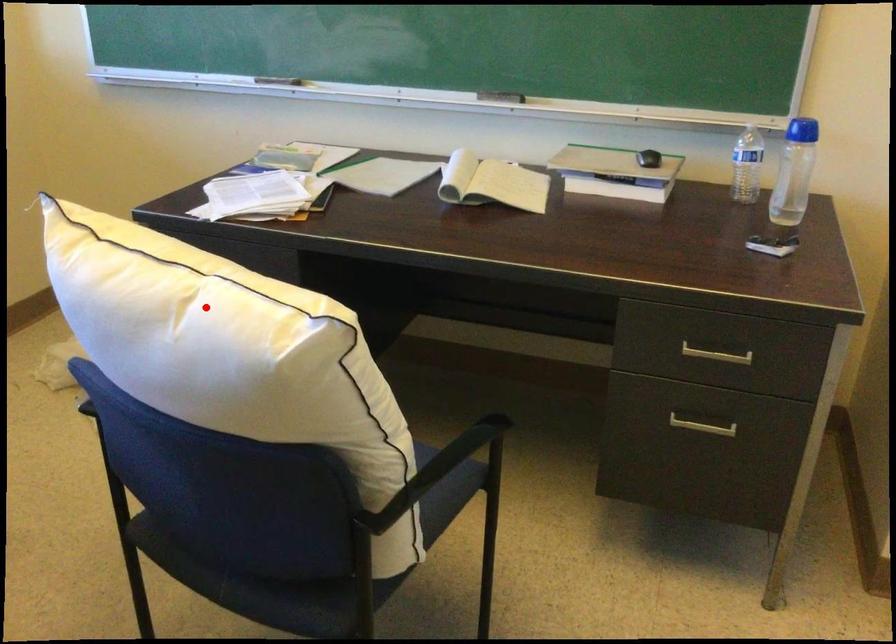
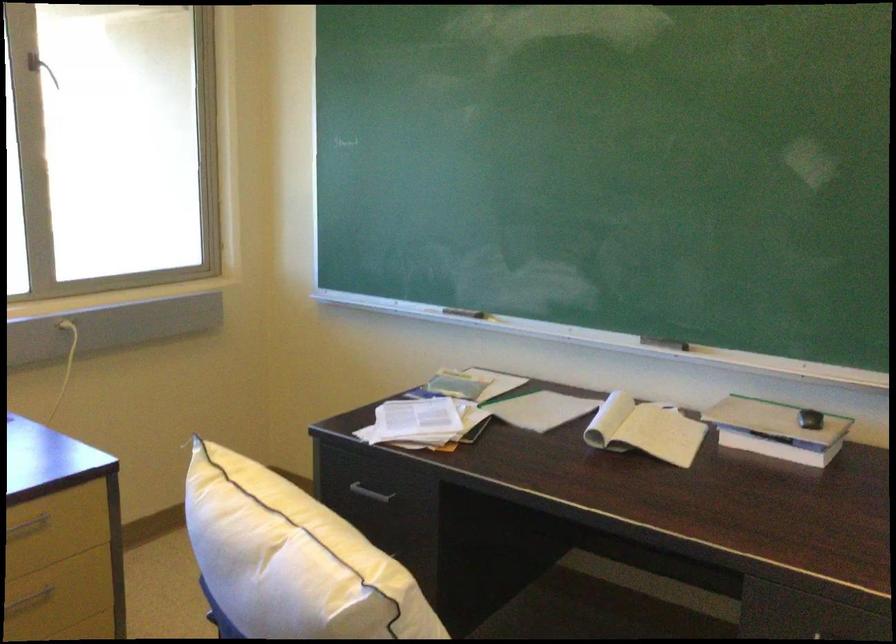
Question: I am providing you with two images of the same scene from different viewpoints. Image1 has a red point marked. In image2, the corresponding 3D location appears at what relative position? Reply with the corresponding letter.

Choices:
 (A) Closer
 (B) Farther

Answer: (B)